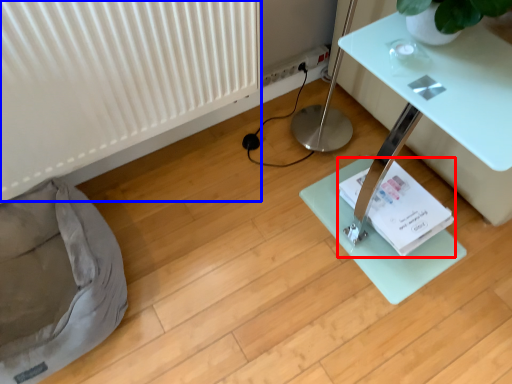
Question: Which object appears closest to the camera in this image, paperback book (highlighted by a red box) or radiator (highlighted by a blue box)?

Choices:
 (A) paperback book
 (B) radiator

Answer: (B)